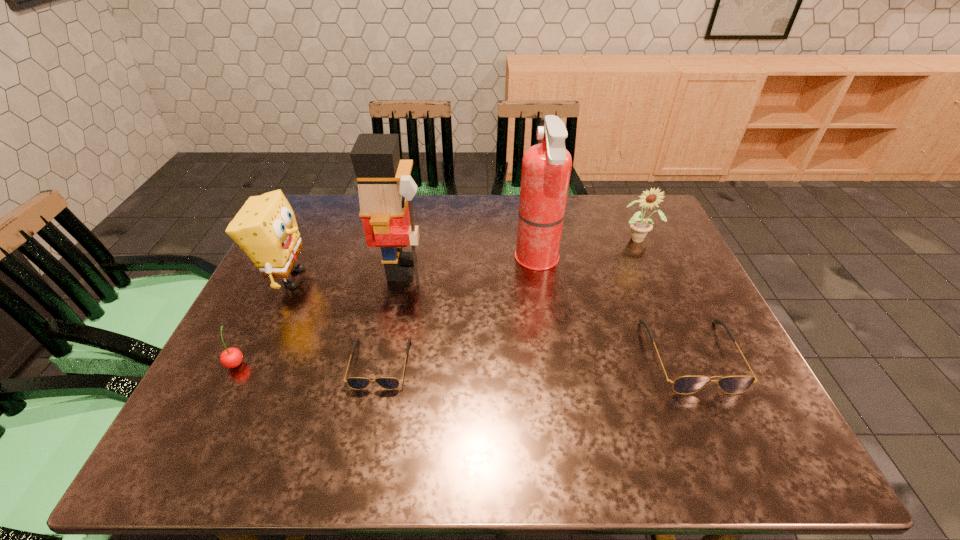
Please point a spot to place another sunglasses for symmetrical spacing. Please provide its 2D coordinates. Your answer should be formatted as a tuple, i.e. [(x, y)], where the tuple contains the x and y coordinates of a point satisfying the conditions above.

[(537, 359)]